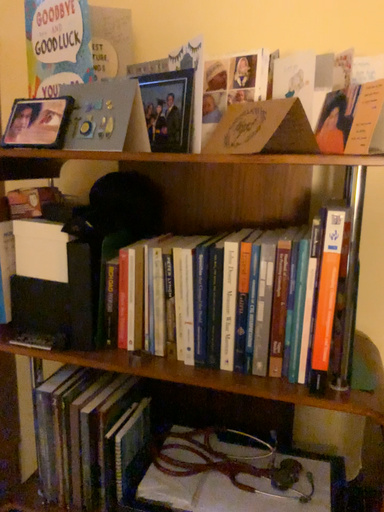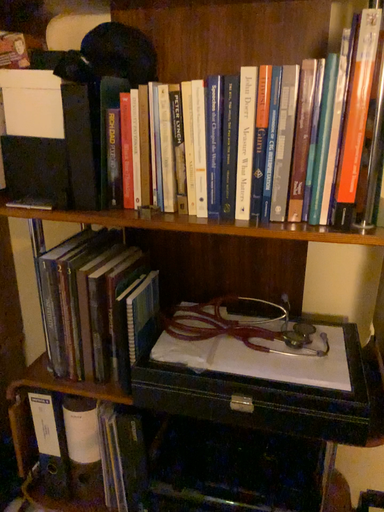
Question: How did the camera likely rotate when shooting the video?

Choices:
 (A) rotated downward
 (B) rotated upward

Answer: (A)